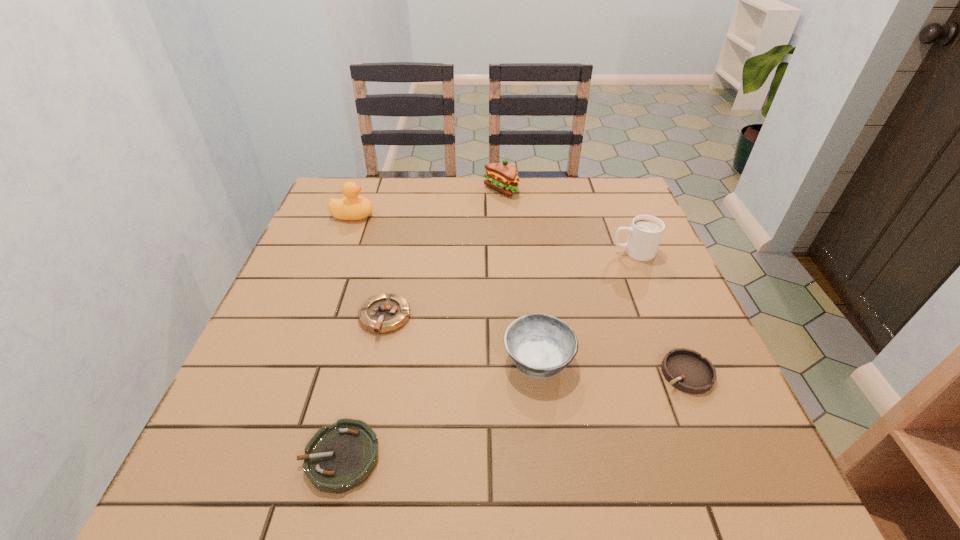
Where is `object that is at the near edge`? This screenshot has height=540, width=960. object that is at the near edge is located at coordinates (339, 457).

Where is `object located in the left edge section of the desktop`? object located in the left edge section of the desktop is located at coordinates [353, 207].

This screenshot has width=960, height=540. Identify the location of cappuccino positioned at the right edge. (645, 233).

This screenshot has height=540, width=960. In order to click on ashtray at the right edge in this screenshot , I will do `click(686, 370)`.

You are a GUI agent. You are given a task and a screenshot of the screen. Output one action in this format:
    pyautogui.click(x=<x>, y=<y>)
    Task: Click on the object that is at the far left corner
    
    Given the screenshot: What is the action you would take?
    pyautogui.click(x=353, y=207)

This screenshot has height=540, width=960. In the image, there is a desktop. Identify the location of free space at the far edge. (498, 195).

The width and height of the screenshot is (960, 540). I want to click on free region at the near edge, so click(x=471, y=500).

The height and width of the screenshot is (540, 960). In order to click on vacant space at the left edge of the desktop in this screenshot , I will do `click(305, 313)`.

This screenshot has width=960, height=540. I want to click on free space at the right edge of the desktop, so coord(642,264).

The height and width of the screenshot is (540, 960). In the image, there is a desktop. Identify the location of vacant space at the far left corner. (325, 214).